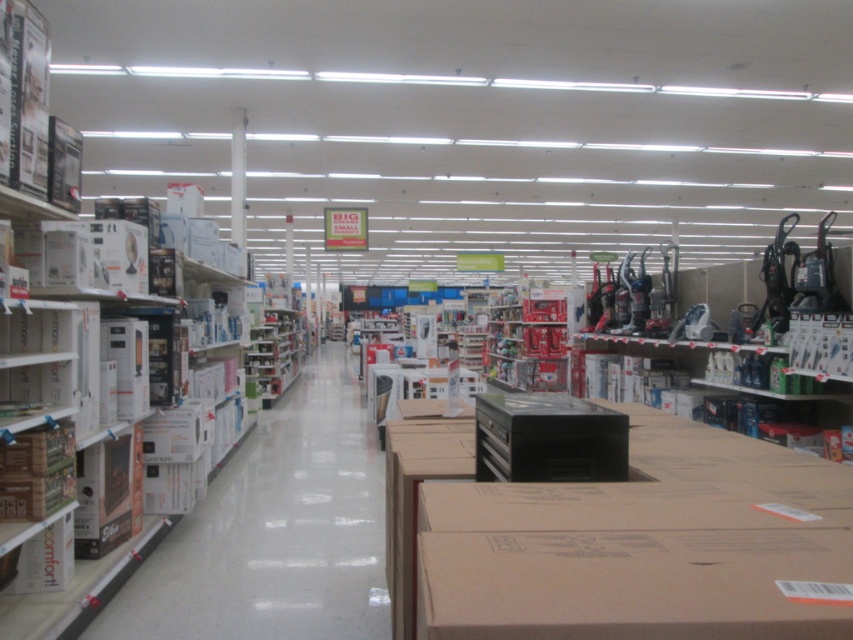
Is the position of brown cardboard box at center less distant than that of white cardboard boxes at left?

Yes, it is in front of white cardboard boxes at left.

You are a GUI agent. You are given a task and a screenshot of the screen. Output one action in this format:
    pyautogui.click(x=<x>, y=<y>)
    Task: Click on the brown cardboard box at center
    The image size is (853, 640).
    Given the screenshot: What is the action you would take?
    pyautogui.click(x=628, y=564)

I want to click on brown cardboard box at center, so click(628, 564).